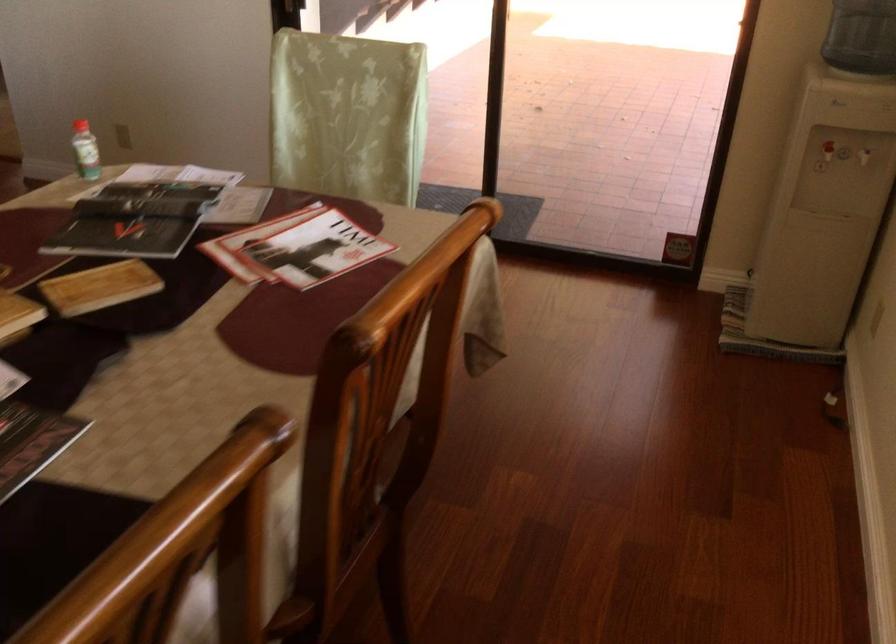
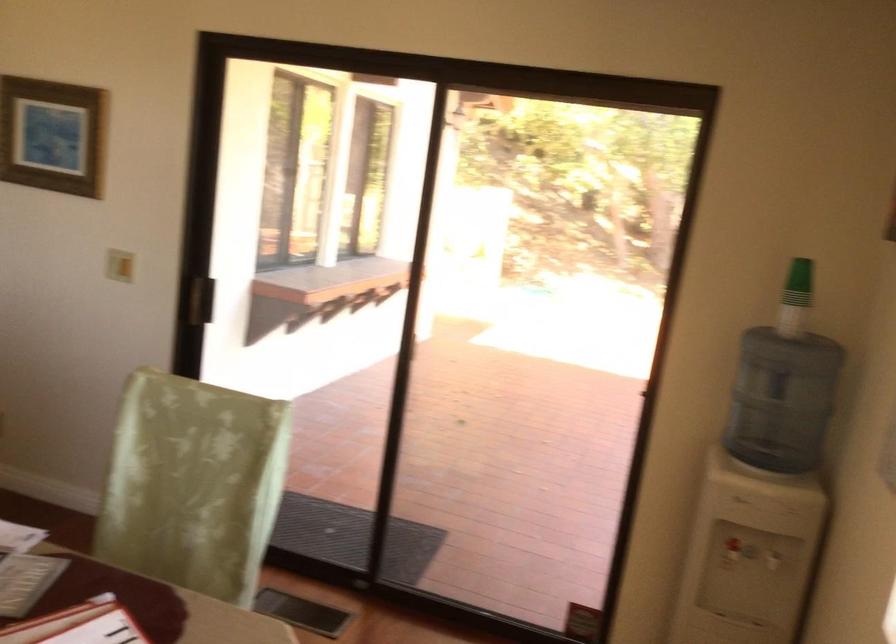
Question: The images are taken continuously from a first-person perspective. In which direction is your viewpoint rotating?

Choices:
 (A) Left
 (B) Right
 (C) Up
 (D) Down

Answer: (C)